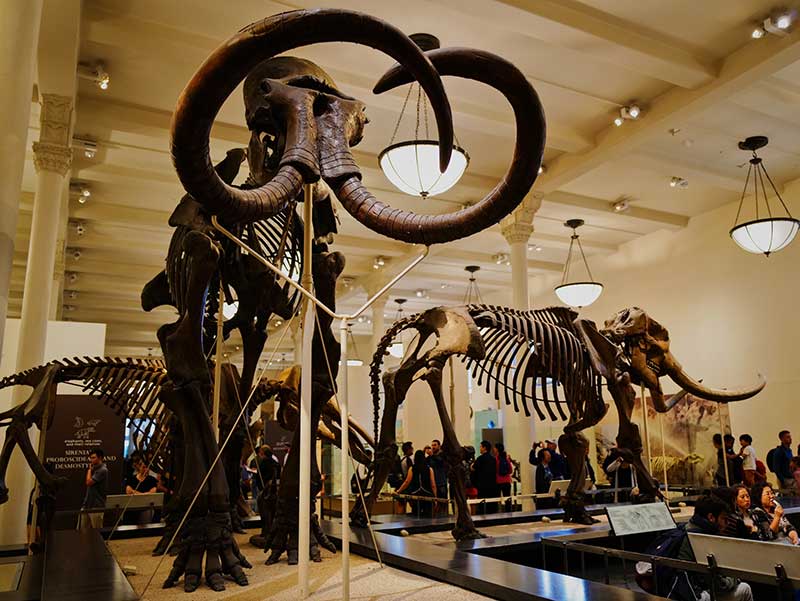
Where is `ceiling supprt beams`? The width and height of the screenshot is (800, 601). ceiling supprt beams is located at coordinates (552, 442), (646, 58), (558, 147), (134, 172), (120, 219), (104, 269).